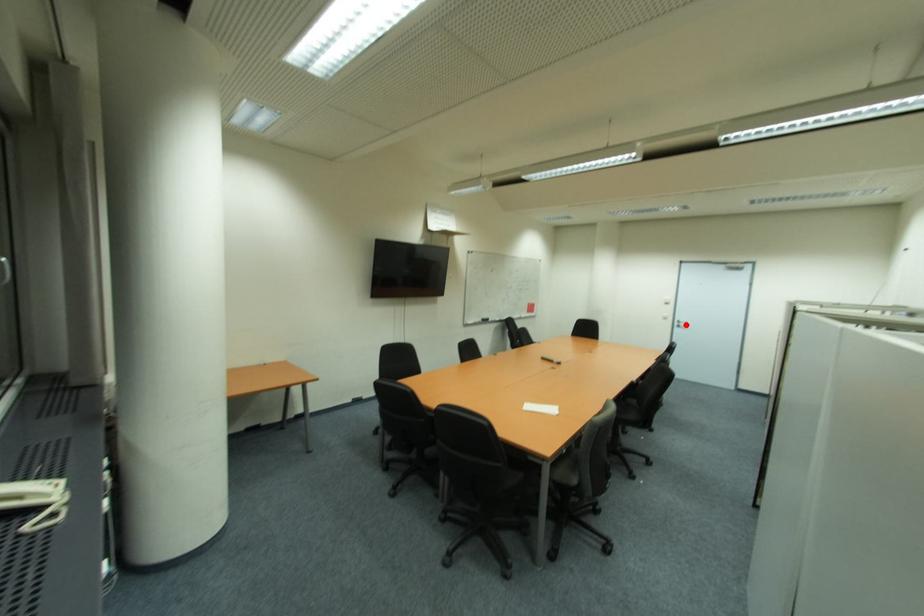
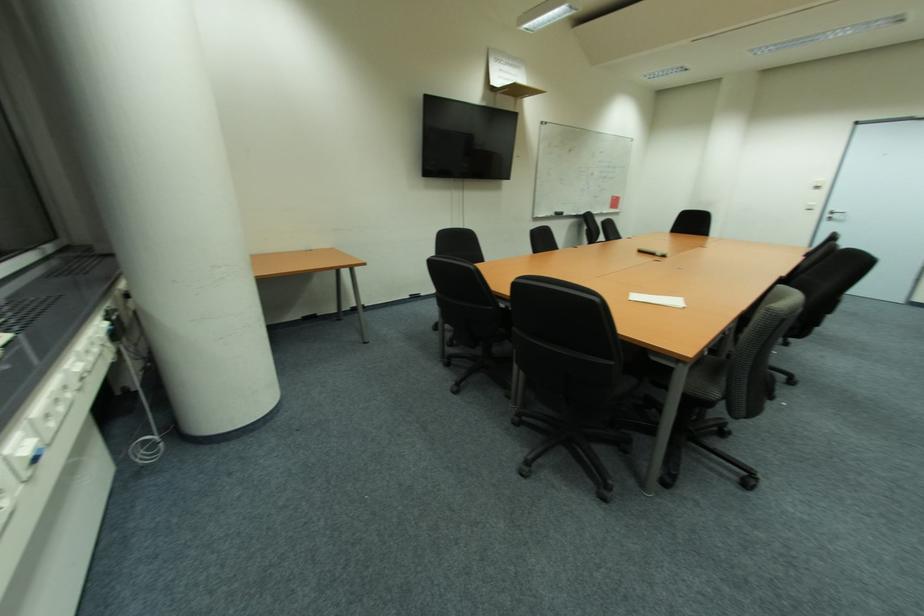
Question: I am providing you with two images of the same scene from different viewpoints. A red point is shown in image1. For the corresponding object point in image2, is it positioned nearer or farther from the camera?

Choices:
 (A) Nearer
 (B) Farther

Answer: (B)